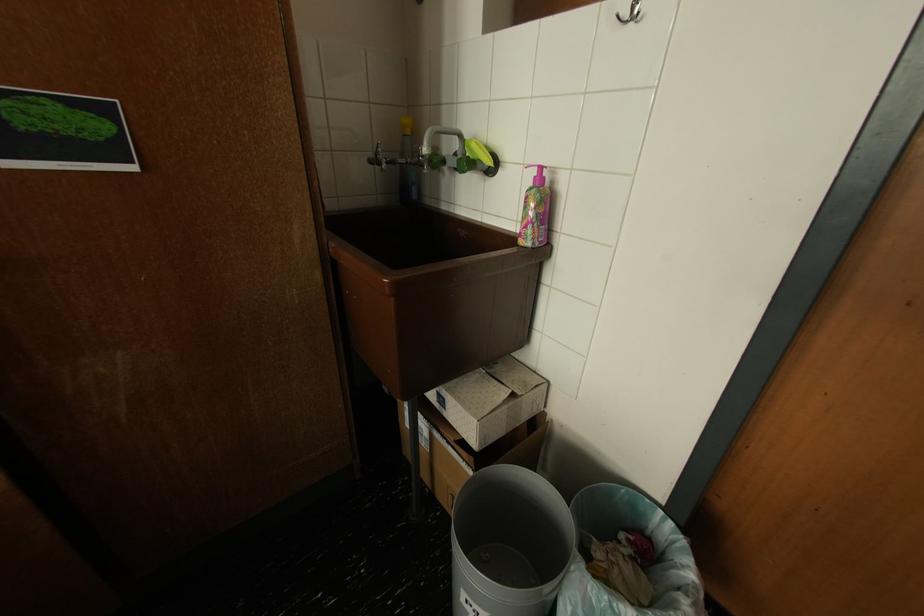
Find where to hang the metal wall hook. Please return your answer as a coordinate pair (x, y).

(630, 13)